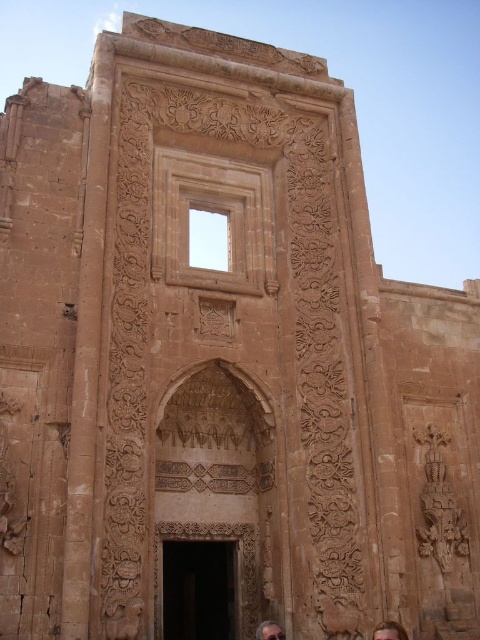
You are standing in front of the ancient stone structure and notice two points marked on its facade. The first point is located at coordinates point (398, 637) and the second at point (277, 630). Which of these points is nearer to your current position?

Point (398, 637) is closer to the camera than point (277, 630), so the first point is nearer to your current position.

You are a tourist standing in front of the ancient stone structure. You notice a detail at point [389,630]. What is located there?

The point [389,630] is where the brown hair at lower center is located.